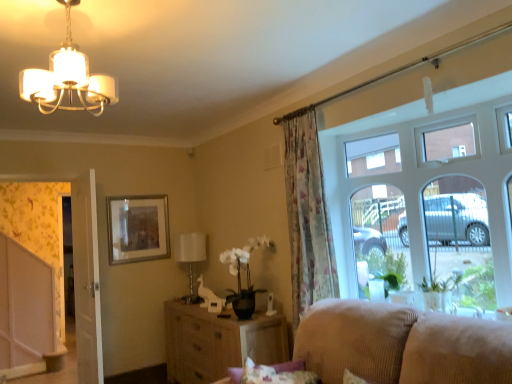
The image size is (512, 384). Identify the location of vacant space situated above silver metallic picture frame at upper center (from a real-world perspective). (135, 190).